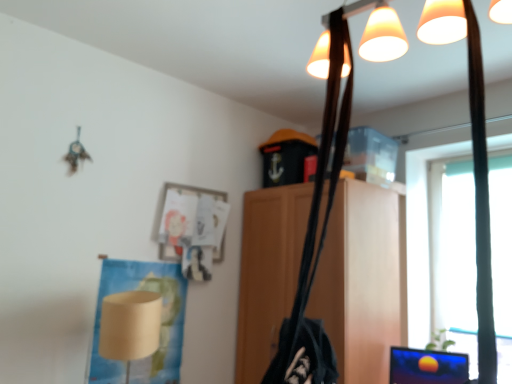
The width and height of the screenshot is (512, 384). What do you see at coordinates (130, 326) in the screenshot?
I see `beige paper lampshade at lower left` at bounding box center [130, 326].

At what (x,y) coordinates should I click in order to perform the action: click on transparent plastic window screen at right. Please return your answer as a coordinate pair (x, y). The image size is (512, 384). Looking at the image, I should click on (421, 237).

Would you consider transparent plastic window screen at right to be distant from beige paper lampshade at lower left?

Absolutely, transparent plastic window screen at right is distant from beige paper lampshade at lower left.

Based on their sizes in the image, would you say transparent plastic window screen at right is bigger or smaller than beige paper lampshade at lower left?

Clearly, transparent plastic window screen at right is smaller in size than beige paper lampshade at lower left.

Considering the points (466, 151) and (135, 291), which point is in front, point (466, 151) or point (135, 291)?

The point (135, 291) is closer.

Between beige paper lampshade at lower left and wooden cabinet at center, which one has larger width?

Wider between the two is wooden cabinet at center.

Find the location of `lamp below the wooden cabinet at center (from a real-world perspective)`. lamp below the wooden cabinet at center (from a real-world perspective) is located at coordinates (130, 326).

From the image's perspective, is beige paper lampshade at lower left on top of wooden cabinet at center?

No, from the image's perspective, beige paper lampshade at lower left is not on top of wooden cabinet at center.

Considering the relative positions of transparent plastic window screen at right and wooden cabinet at center in the image provided, is transparent plastic window screen at right to the right of wooden cabinet at center from the viewer's perspective?

Indeed, transparent plastic window screen at right is positioned on the right side of wooden cabinet at center.

From the picture: Is transparent plastic window screen at right behind wooden cabinet at center?

Yes, transparent plastic window screen at right is further from the camera.

From the image's perspective, which is below, transparent plastic window screen at right or wooden cabinet at center?

wooden cabinet at center, from the image's perspective.

Can you confirm if transparent plastic window screen at right is bigger than wooden cabinet at center?

Actually, transparent plastic window screen at right might be smaller than wooden cabinet at center.

You are a GUI agent. You are given a task and a screenshot of the screen. Output one action in this format:
    pyautogui.click(x=<x>, y=<y>)
    Task: Click on the furniture below the transparent plastic window screen at right (from a real-world perspective)
    This screenshot has height=384, width=512.
    Given the screenshot: What is the action you would take?
    pyautogui.click(x=361, y=281)

Which is more to the right, wooden cabinet at center or transparent plastic window screen at right?

Positioned to the right is transparent plastic window screen at right.

From the image's perspective, relative to transparent plastic window screen at right, is wooden cabinet at center above or below?

From the image's perspective, wooden cabinet at center appears below transparent plastic window screen at right.

Does point (264, 239) appear closer or farther from the camera than point (503, 136)?

Clearly, point (264, 239) is more distant from the camera than point (503, 136).

Which is more to the left, wooden cabinet at center or beige paper lampshade at lower left?

Positioned to the left is beige paper lampshade at lower left.

At what (x,y) coordinates should I click in order to perform the action: click on furniture located on the right of beige paper lampshade at lower left. Please return your answer as a coordinate pair (x, y). This screenshot has width=512, height=384. Looking at the image, I should click on (361, 281).

How distant is wooden cabinet at center from beige paper lampshade at lower left?

wooden cabinet at center and beige paper lampshade at lower left are 94.82 centimeters apart.

From the image's perspective, which one is positioned higher, wooden cabinet at center or beige paper lampshade at lower left?

A: wooden cabinet at center, from the image's perspective.

Is beige paper lampshade at lower left positioned with its back to transparent plastic window screen at right?

No, transparent plastic window screen at right is not at the back of beige paper lampshade at lower left.

Can you confirm if beige paper lampshade at lower left is positioned to the left of transparent plastic window screen at right?

Indeed, beige paper lampshade at lower left is positioned on the left side of transparent plastic window screen at right.

Between point (144, 315) and point (414, 209), which one is positioned behind?

Positioned behind is point (414, 209).

Based on the photo, is beige paper lampshade at lower left positioned beyond the bounds of transparent plastic window screen at right?

Yes.

This screenshot has height=384, width=512. I want to click on lamp that appears on the left of transparent plastic window screen at right, so click(130, 326).

This screenshot has width=512, height=384. I want to click on furniture located on the right of beige paper lampshade at lower left, so click(361, 281).

From the image, which object appears to be farther from transparent plastic window screen at right, beige paper lampshade at lower left or wooden cabinet at center?

Based on the image, beige paper lampshade at lower left appears to be further to transparent plastic window screen at right.

From the picture: Looking at the image, which one is located further to transparent plastic window screen at right, wooden cabinet at center or beige paper lampshade at lower left?

beige paper lampshade at lower left is further to transparent plastic window screen at right.

Based on their spatial positions, is transparent plastic window screen at right or wooden cabinet at center further from beige paper lampshade at lower left?

Among the two, transparent plastic window screen at right is located further to beige paper lampshade at lower left.

Based on their spatial positions, is transparent plastic window screen at right or beige paper lampshade at lower left closer to wooden cabinet at center?

The object closer to wooden cabinet at center is transparent plastic window screen at right.

Which object lies further to the anchor point wooden cabinet at center, beige paper lampshade at lower left or transparent plastic window screen at right?

beige paper lampshade at lower left.

Estimate the real-world distances between objects in this image. Which object is closer to beige paper lampshade at lower left, wooden cabinet at center or transparent plastic window screen at right?

wooden cabinet at center lies closer to beige paper lampshade at lower left than the other object.

Where is `furniture between beige paper lampshade at lower left and transparent plastic window screen at right from left to right`? furniture between beige paper lampshade at lower left and transparent plastic window screen at right from left to right is located at coordinates (361, 281).